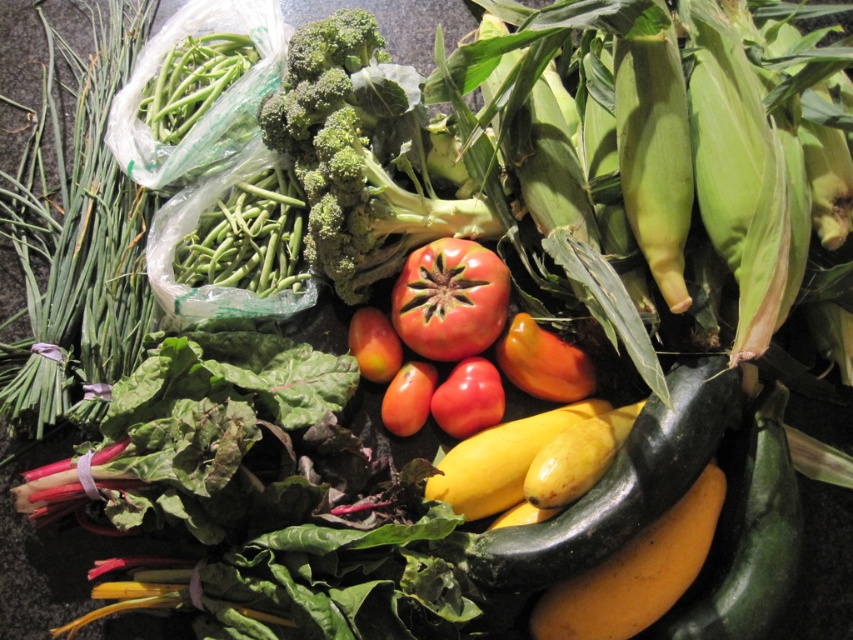
Question: Which object is closer to the camera taking this photo?

Choices:
 (A) red matte tomato at center
 (B) glossy red tomato at center
 (C) green matte broccoli at center
 (D) ripe red tomato at center

Answer: (C)

Question: Considering the real-world distances, which object is closest to the smooth red tomato at center?

Choices:
 (A) ripe red tomato at center
 (B) ripe yellow banana at lower right
 (C) green matte broccoli at center

Answer: (A)

Question: Is green matte broccoli at center closer to camera compared to yellow smooth squash at center?

Choices:
 (A) no
 (B) yes

Answer: (B)

Question: Considering the real-world distances, which object is farthest from the ripe yellow banana at lower right?

Choices:
 (A) smooth red tomato at center
 (B) glossy red tomato at center
 (C) green matte broccoli at center

Answer: (C)

Question: From the image, what is the correct spatial relationship of green matte broccoli at center in relation to glossy red tomato at center?

Choices:
 (A) below
 (B) above

Answer: (B)

Question: Is green matte broccoli at center closer to the viewer compared to yellow smooth squash at center?

Choices:
 (A) no
 (B) yes

Answer: (B)